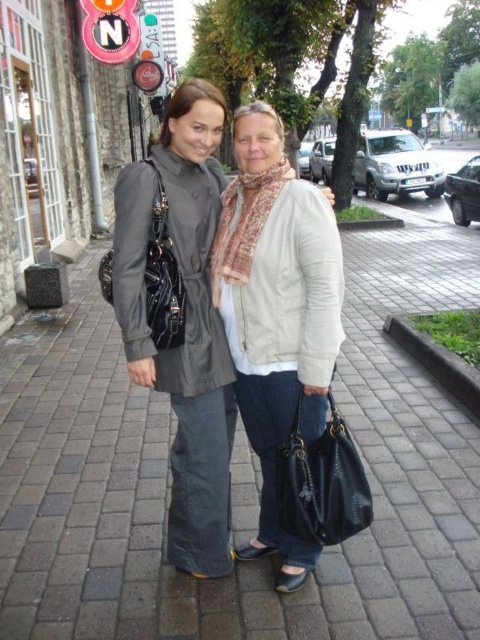
You are a delivery person who needs to determine which item is taller between the matte gray coat at center and the matte black bag at left. Based on the scene, can you identify which one is taller?

The matte gray coat at center is taller than the matte black bag at left according to the description.

You are a delivery person trying to place a package on the ground between the matte gray pavement at center and the black leather handbag at center. Can you fit the package there?

The matte gray pavement at center is positioned over the black leather handbag at center, meaning there is no space between them. Therefore, you cannot fit the package between them.

You are a delivery person who needs to place a package on the ground near the matte gray coat at center without getting it wet. There is a small puddle at point 0.503, 0.385. Where should you place the package?

The matte gray coat at center is located at point (x=184, y=321), which is where the puddle is. To avoid getting the package wet, you should place it somewhere else away from that location.